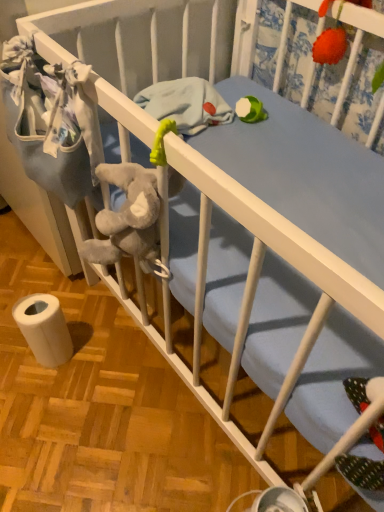
The image size is (384, 512). Identify the location of vacant space situated on the left part of white matte toilet paper at lower left. (13, 351).